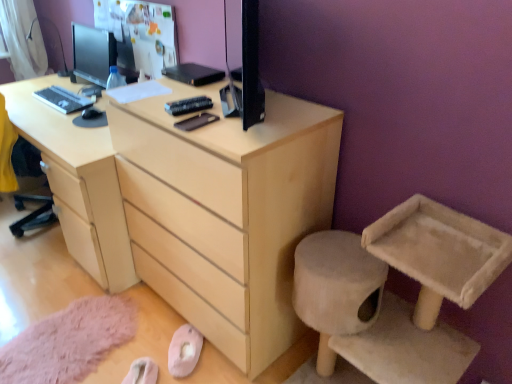
Where is `vacant area on top of light wood chest of drawers at center (from a real-world perspective)`? The height and width of the screenshot is (384, 512). vacant area on top of light wood chest of drawers at center (from a real-world perspective) is located at coordinates (186, 91).